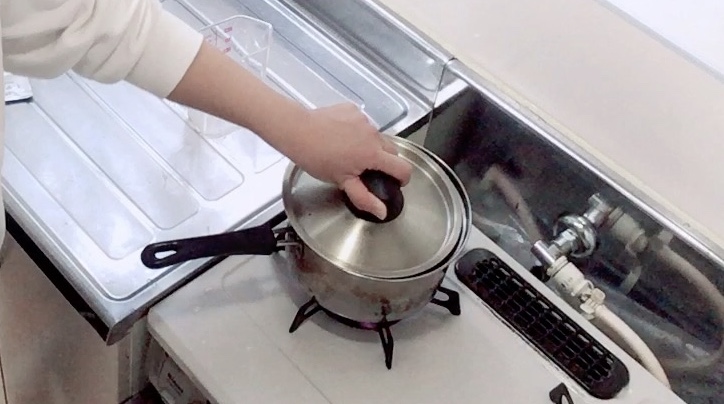
This screenshot has height=404, width=724. Find the location of `vent`. vent is located at coordinates (575, 348).